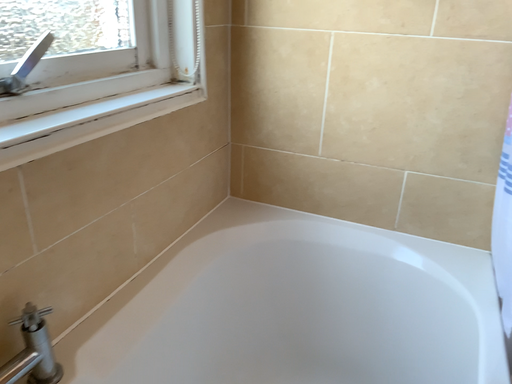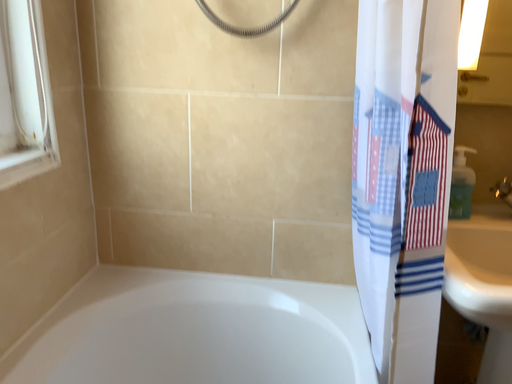
Question: Which way did the camera rotate in the video?

Choices:
 (A) rotated downward
 (B) rotated upward

Answer: (B)